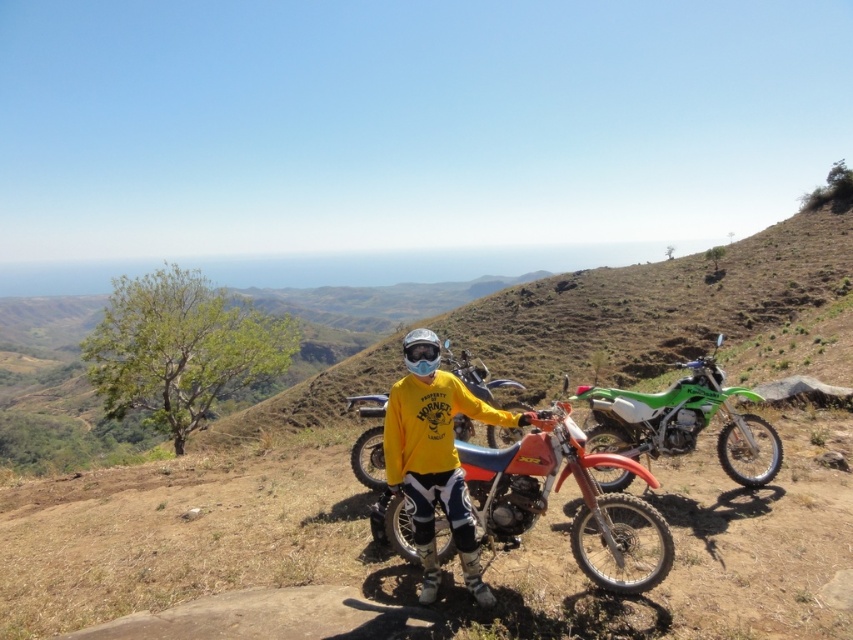
Is brown dirt hillside at center positioned in front of yellow matte shirt at center?

No.

Does point (755, 330) lie behind point (402, 483)?

Yes, it is behind point (402, 483).

Find the location of a particular element. This screenshot has width=853, height=640. brown dirt hillside at center is located at coordinates (630, 305).

Is matte orange dirt bike at center taller than matte red dirt bike at center?

In fact, matte orange dirt bike at center may be shorter than matte red dirt bike at center.

Is matte orange dirt bike at center closer to camera compared to matte red dirt bike at center?

Yes, it is.

Does point (625, 582) come in front of point (361, 472)?

Yes, it is in front of point (361, 472).

This screenshot has width=853, height=640. I want to click on matte orange dirt bike at center, so click(x=576, y=509).

Which is behind, point (643, 476) or point (424, 342)?

The point (643, 476) is more distant.

Which of these two, matte orange dirt bike at center or glossy white helmet at center, stands shorter?

Standing shorter between the two is glossy white helmet at center.

Does point (495, 483) come farther from viewer compared to point (430, 371)?

Yes.

This screenshot has height=640, width=853. What are the coordinates of `matte orange dirt bike at center` in the screenshot? It's located at (576, 509).